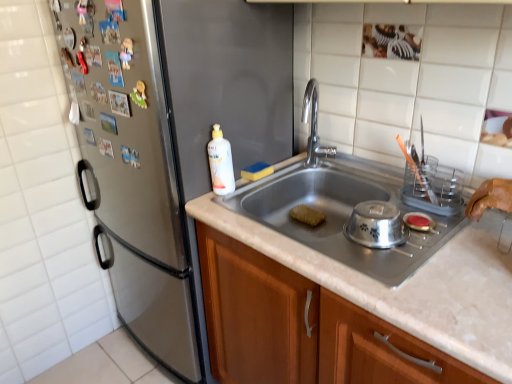
Find the location of `vacant space to the right of polished stainless steel faucet at center`. vacant space to the right of polished stainless steel faucet at center is located at coordinates (366, 173).